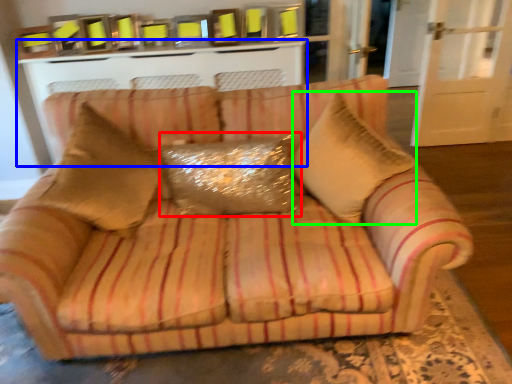
Question: Considering the real-world distances, which object is farthest from pillow (highlighted by a red box)? table (highlighted by a blue box) or throw pillow (highlighted by a green box)?

Choices:
 (A) table
 (B) throw pillow

Answer: (A)